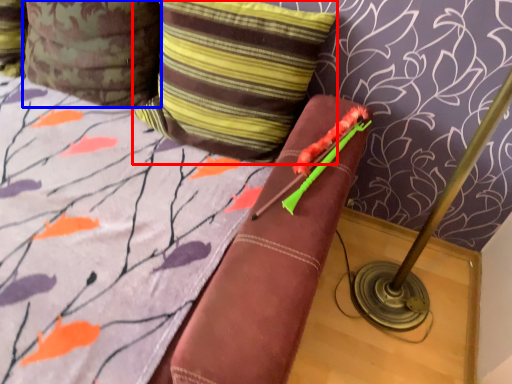
Question: Which object is further to the camera taking this photo, pillow (highlighted by a red box) or pillow (highlighted by a blue box)?

Choices:
 (A) pillow
 (B) pillow

Answer: (B)